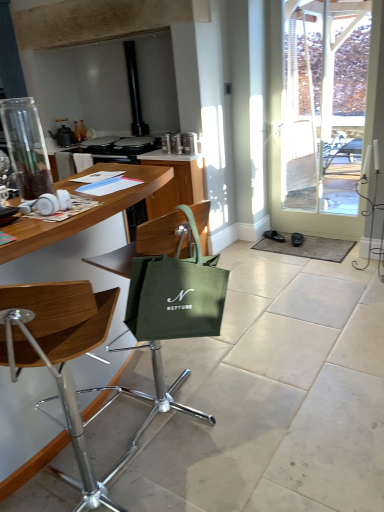
What do you see at coordinates (176, 293) in the screenshot? Image resolution: width=384 pixels, height=512 pixels. I see `green canvas bag at center` at bounding box center [176, 293].

What do you see at coordinates (26, 147) in the screenshot? I see `clear glass jar at left` at bounding box center [26, 147].

This screenshot has height=512, width=384. Identify the location of woodenmaterial/texturetable at left. [x=85, y=211].

Measure the distance between point (x=178, y=379) and camera.

Point (x=178, y=379) and camera are 2.23 meters apart from each other.

The height and width of the screenshot is (512, 384). Identify the location of black leather shoe at lower right, the 2th footwear positioned from the right. (274, 236).

Is metallic black kettle at upper left at the back of green fabric bag at center, acting as the 1th chair starting from the back?

That's not correct — green fabric bag at center, acting as the 1th chair starting from the back, is not looking away from metallic black kettle at upper left.

Which chair is the 2nd one when counting from the right side of the metallic black kettle at upper left? Please provide its 2D coordinates.

[(159, 389)]

Is metallic black kettle at upper left surrounded by green fabric bag at center, which appears as the 2th chair when viewed from the front?

No, metallic black kettle at upper left is not inside green fabric bag at center, which appears as the 2th chair when viewed from the front.

Between point (120, 270) and point (66, 130), which one is positioned in front?

Point (120, 270)

Is green fabric bag at center, which appears as the 2th chair when viewed from the front, to the right of clear glass jar at left from the viewer's perspective?

Indeed, green fabric bag at center, which appears as the 2th chair when viewed from the front, is positioned on the right side of clear glass jar at left.

Considering the relative sizes of green fabric bag at center, which appears as the 2th chair when viewed from the front, and clear glass jar at left in the image provided, is green fabric bag at center, which appears as the 2th chair when viewed from the front, taller than clear glass jar at left?

Correct, green fabric bag at center, which appears as the 2th chair when viewed from the front, is much taller as clear glass jar at left.

Does green fabric bag at center, which appears as the 2th chair when viewed from the front, turn towards clear glass jar at left?

No, green fabric bag at center, which appears as the 2th chair when viewed from the front, does not turn towards clear glass jar at left.

Which of these two, green canvas bag at center or woodenmaterial/texturetable at left, stands shorter?

Standing shorter between the two is green canvas bag at center.

Is green canvas bag at center facing away from woodenmaterial/texturetable at left?

Yes, green canvas bag at center is facing away from woodenmaterial/texturetable at left.

Is green canvas bag at center positioned beyond the bounds of woodenmaterial/texturetable at left?

Absolutely, green canvas bag at center is external to woodenmaterial/texturetable at left.

Which object is positioned more to the left, green canvas bag at center or woodenmaterial/texturetable at left?

woodenmaterial/texturetable at left.

Which object is positioned more to the right, wooden at left, which appears as the 2th chair when viewed from the back, or green fabric cabinet at center?

Positioned to the right is green fabric cabinet at center.

From the image's perspective, between wooden at left, which appears as the 2th chair when viewed from the back, and green fabric cabinet at center, which one is located above?

green fabric cabinet at center is shown above in the image.

From a real-world perspective, who is located lower, wooden at left, which appears as the 2th chair when viewed from the back, or green fabric cabinet at center?

green fabric cabinet at center is physically lower.

Based on the photo, how many degrees apart are the facing directions of wooden at left, which appears as the 2th chair when viewed from the back, and green fabric cabinet at center?

There is a 141-degree angle between the facing directions of wooden at left, which appears as the 2th chair when viewed from the back, and green fabric cabinet at center.

Could you measure the distance between green fabric bag at center, acting as the 1th chair starting from the back, and green canvas bag at center?

They are 21.93 inches apart.

Is green fabric bag at center, acting as the 1th chair starting from the back, turned away from green canvas bag at center?

Yes.

Which is behind, green fabric bag at center, acting as the 1th chair starting from the back, or green canvas bag at center?

Positioned behind is green fabric bag at center, acting as the 1th chair starting from the back.

Can you confirm if green fabric bag at center, acting as the 1th chair starting from the back, is positioned to the right of green canvas bag at center?

No.

From the image's perspective, does green fabric bag at center, which appears as the 2th chair when viewed from the front, appear lower than wooden at left, which appears as the 2th chair when viewed from the back?

Incorrect, from the image's perspective, green fabric bag at center, which appears as the 2th chair when viewed from the front, is higher than wooden at left, which appears as the 2th chair when viewed from the back.

Based on the photo, is green fabric bag at center, acting as the 1th chair starting from the back, oriented away from wooden at left, which appears as the 2th chair when viewed from the back?

green fabric bag at center, acting as the 1th chair starting from the back, is not turned away from wooden at left, which appears as the 2th chair when viewed from the back.

Consider the image. Does green fabric bag at center, which appears as the 2th chair when viewed from the front, appear on the right side of wooden at left, arranged as the first chair when viewed from the front?

Correct, you'll find green fabric bag at center, which appears as the 2th chair when viewed from the front, to the right of wooden at left, arranged as the first chair when viewed from the front.

From a real-world perspective, relative to wooden at left, arranged as the first chair when viewed from the front, is green fabric bag at center, which appears as the 2th chair when viewed from the front, vertically above or below?

green fabric bag at center, which appears as the 2th chair when viewed from the front, is situated higher than wooden at left, arranged as the first chair when viewed from the front, in the real world.

Image resolution: width=384 pixels, height=512 pixels. I want to click on chair that is the 1st one when counting forward from the black leather shoe at lower right, the 2th footwear from the left, so click(159, 389).

Between green fabric bag at center, acting as the 1th chair starting from the back, and black leather shoe at lower right, which ranks as the 1th footwear in right-to-left order, which one has larger size?

Bigger between the two is green fabric bag at center, acting as the 1th chair starting from the back.

Considering the relative positions of green fabric bag at center, which appears as the 2th chair when viewed from the front, and black leather shoe at lower right, the 2th footwear from the left, in the image provided, is green fabric bag at center, which appears as the 2th chair when viewed from the front, behind black leather shoe at lower right, the 2th footwear from the left,?

No, green fabric bag at center, which appears as the 2th chair when viewed from the front, is in front of black leather shoe at lower right, the 2th footwear from the left.

From the image's perspective, is green fabric bag at center, which appears as the 2th chair when viewed from the front, over black leather shoe at lower right, the 2th footwear from the left?

No, from the image's perspective, green fabric bag at center, which appears as the 2th chair when viewed from the front, is not on top of black leather shoe at lower right, the 2th footwear from the left.

Identify the location of the 1st chair in front of the metallic black kettle at upper left, starting your count from the anchor. (159, 389).

The image size is (384, 512). What are the coordinates of `the 2nd chair counting from the right of the clear glass jar at left` in the screenshot? It's located at (159, 389).

From the image, which object appears to be farther from black leather shoe at lower right, the 2th footwear positioned from the right, green fabric cabinet at center or wooden at left, which appears as the 2th chair when viewed from the back?

wooden at left, which appears as the 2th chair when viewed from the back, is positioned further to the anchor black leather shoe at lower right, the 2th footwear positioned from the right.

When comparing their distances from black leather shoe at lower right, which ranks as the 1th footwear in right-to-left order, does green fabric bag at center, acting as the 1th chair starting from the back, or wooden at left, arranged as the first chair when viewed from the front, seem further?

Among the two, wooden at left, arranged as the first chair when viewed from the front, is located further to black leather shoe at lower right, which ranks as the 1th footwear in right-to-left order.

When comparing their distances from green fabric cabinet at center, does green canvas bag at center or woodenmaterial/texturetable at left seem further?

green canvas bag at center is positioned further to the anchor green fabric cabinet at center.

Based on their spatial positions, is green fabric bag at center, which appears as the 2th chair when viewed from the front, or black leather shoe at lower right, placed as the first footwear when sorted from left to right, further from clear glass jar at left?

black leather shoe at lower right, placed as the first footwear when sorted from left to right.

Which object lies further to the anchor point green canvas bag at center, green fabric cabinet at center or transparent glass door at right?

transparent glass door at right is positioned further to the anchor green canvas bag at center.

Which object lies further to the anchor point clear glass jar at left, green fabric bag at center, acting as the 1th chair starting from the back, or woodenmaterial/texturetable at left?

green fabric bag at center, acting as the 1th chair starting from the back, lies further to clear glass jar at left than the other object.

Considering their positions, is black leather shoe at lower right, placed as the first footwear when sorted from left to right, positioned closer to metallic black kettle at upper left than green fabric cabinet at center?

Based on the image, green fabric cabinet at center appears to be nearer to metallic black kettle at upper left.

Considering their positions, is green canvas bag at center positioned further to metallic black kettle at upper left than wooden at left, which appears as the 2th chair when viewed from the back?

wooden at left, which appears as the 2th chair when viewed from the back, is further to metallic black kettle at upper left.

Image resolution: width=384 pixels, height=512 pixels. Identify the location of cabinetry positioned between green canvas bag at center and black leather shoe at lower right, the 2th footwear from the left, from near to far. (175, 182).

Identify the location of cabinetry located between clear glass jar at left and black leather shoe at lower right, placed as the first footwear when sorted from left to right, in the depth direction. (175, 182).

This screenshot has width=384, height=512. I want to click on chair between wooden at left, arranged as the first chair when viewed from the front, and metallic black kettle at upper left, along the z-axis, so click(x=159, y=389).

At what (x,y) coordinates should I click in order to perform the action: click on kitchen appliance between wooden at left, which appears as the 2th chair when viewed from the back, and transparent glass door at right, along the z-axis. Please return your answer as a coordinate pair (x, y). This screenshot has width=384, height=512. Looking at the image, I should click on (26, 147).